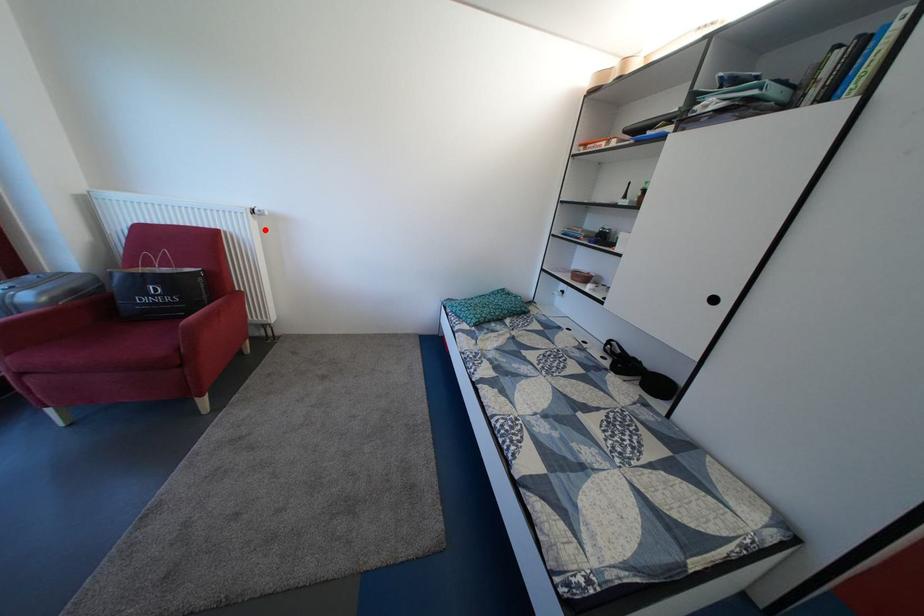
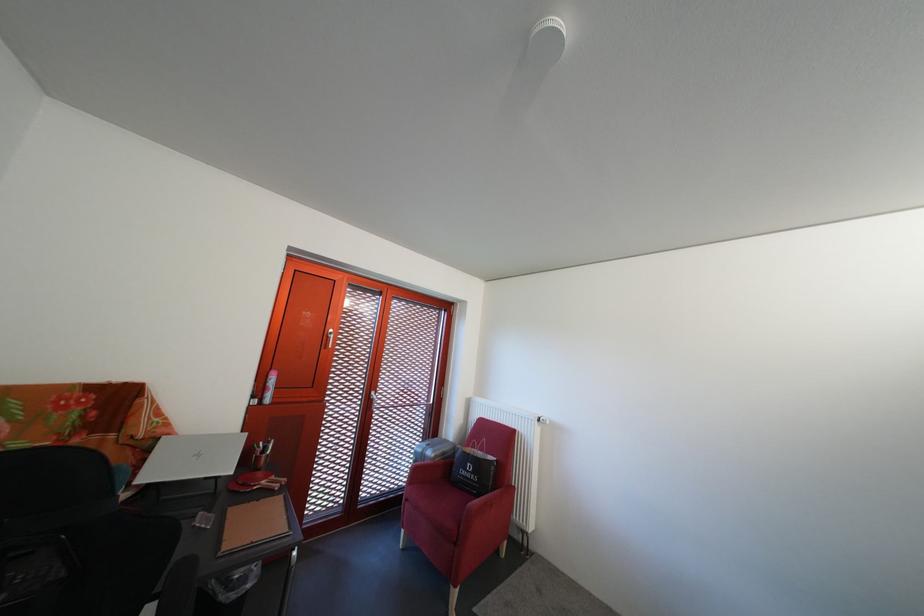
In the second image, find the point that corresponds to the highlighted location in the first image.

(549, 436)